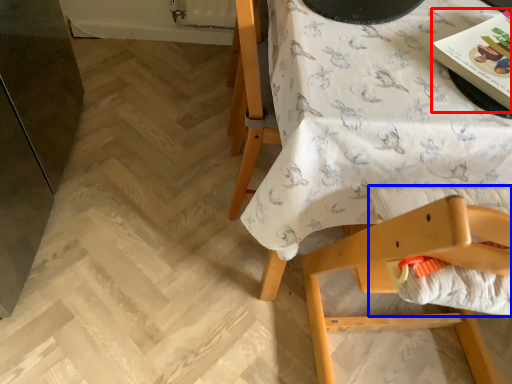
Question: Which object is closer to the camera taking this photo, magazine (highlighted by a red box) or sheet (highlighted by a blue box)?

Choices:
 (A) magazine
 (B) sheet

Answer: (B)